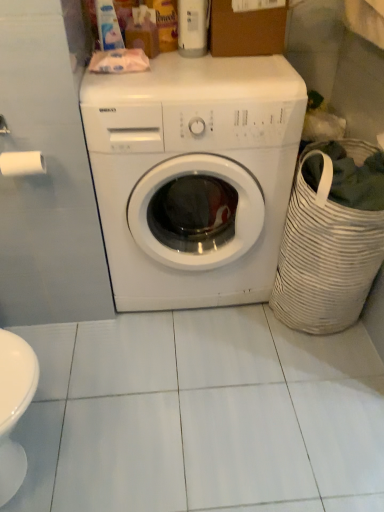
Where is `vacant position to the left of white woven laundry basket at right`? vacant position to the left of white woven laundry basket at right is located at coordinates pos(231,345).